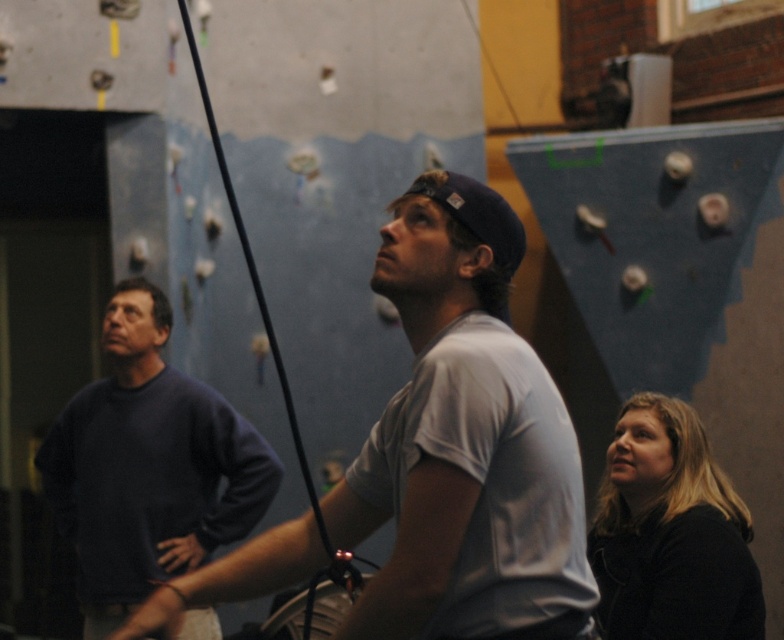
Does dark blue sweater at left have a greater height compared to black matte jacket at lower right?

Indeed, dark blue sweater at left has a greater height compared to black matte jacket at lower right.

Between point (173, 500) and point (673, 600), which one is positioned behind?

Point (173, 500)

At what (x,y) coordinates should I click in order to perform the action: click on dark blue sweater at left. Please return your answer as a coordinate pair (x, y). This screenshot has height=640, width=784. Looking at the image, I should click on (147, 465).

What do you see at coordinates (463, 442) in the screenshot? I see `gray cotton t-shirt at center` at bounding box center [463, 442].

Based on the photo, can you confirm if gray cotton t-shirt at center is positioned to the left of dark blue sweater at left?

Incorrect, gray cotton t-shirt at center is not on the left side of dark blue sweater at left.

Which is in front, point (550, 424) or point (103, 392)?

Point (550, 424) is in front.

Find the location of a particular element. This screenshot has height=640, width=784. gray cotton t-shirt at center is located at coordinates (463, 442).

In the scene shown: Can you confirm if gray cotton t-shirt at center is positioned to the left of black matte jacket at lower right?

Correct, you'll find gray cotton t-shirt at center to the left of black matte jacket at lower right.

Does gray cotton t-shirt at center have a greater width compared to black matte jacket at lower right?

Yes.

What do you see at coordinates (463, 442) in the screenshot?
I see `gray cotton t-shirt at center` at bounding box center [463, 442].

At what (x,y) coordinates should I click in order to perform the action: click on gray cotton t-shirt at center. Please return your answer as a coordinate pair (x, y). The image size is (784, 640). Looking at the image, I should click on (463, 442).